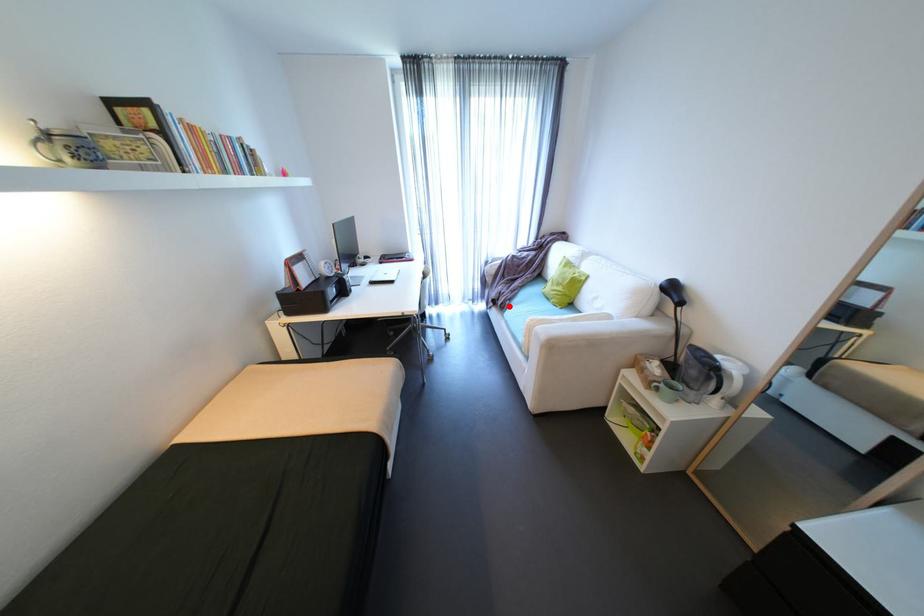
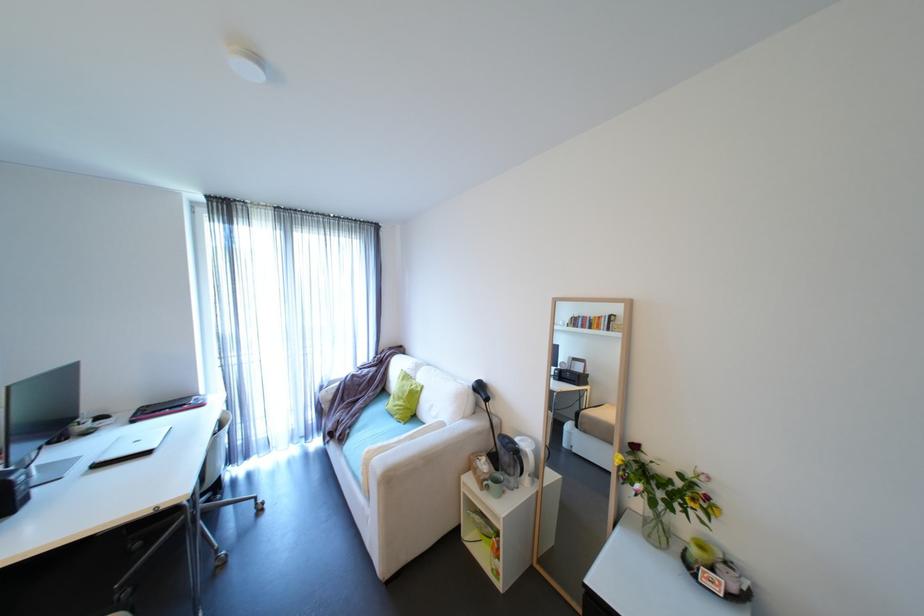
In the second image, find the point that corresponds to the highlighted location in the first image.

(347, 438)